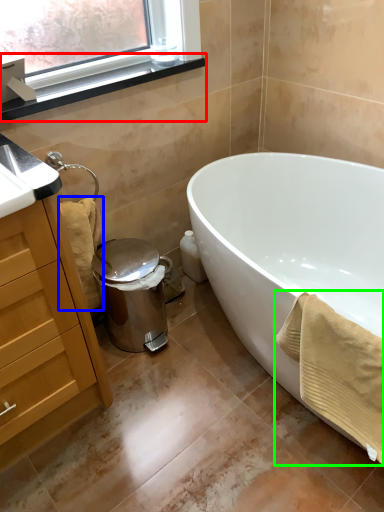
Question: Which is nearer to the window sill (highlighted by a red box)? bath towel (highlighted by a blue box) or bath towel (highlighted by a green box).

Choices:
 (A) bath towel
 (B) bath towel

Answer: (A)